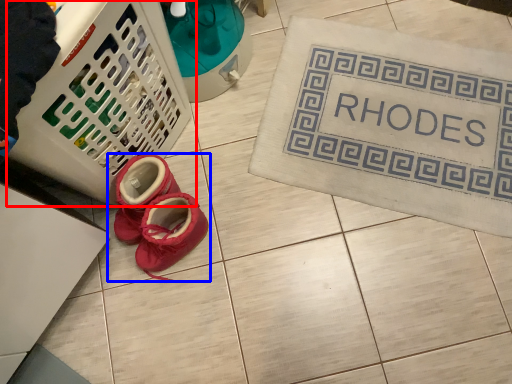
Question: Which object appears closest to the camera in this image, basket (highlighted by a red box) or footwear (highlighted by a blue box)?

Choices:
 (A) basket
 (B) footwear

Answer: (A)